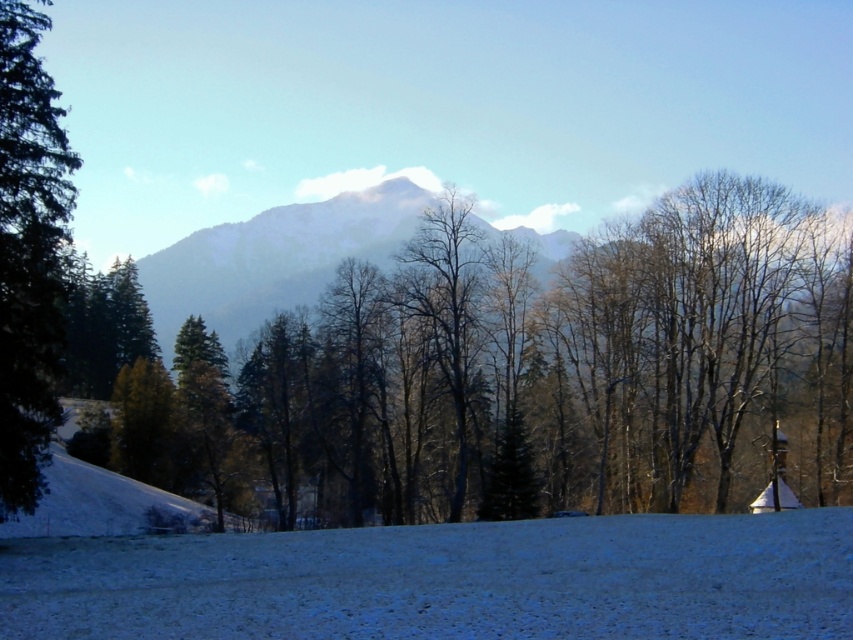
You are an observer standing at the base of the hill. Looking at the white snow at lower center and the green matte tree at left, which object appears taller from your viewpoint?

The green matte tree at left appears taller than the white snow at lower center.

You are standing on the white snow at lower center and want to walk towards the green matte tree at left. Which direction should you head?

You should head upwards towards the green matte tree at left because the white snow at lower center is located below it.